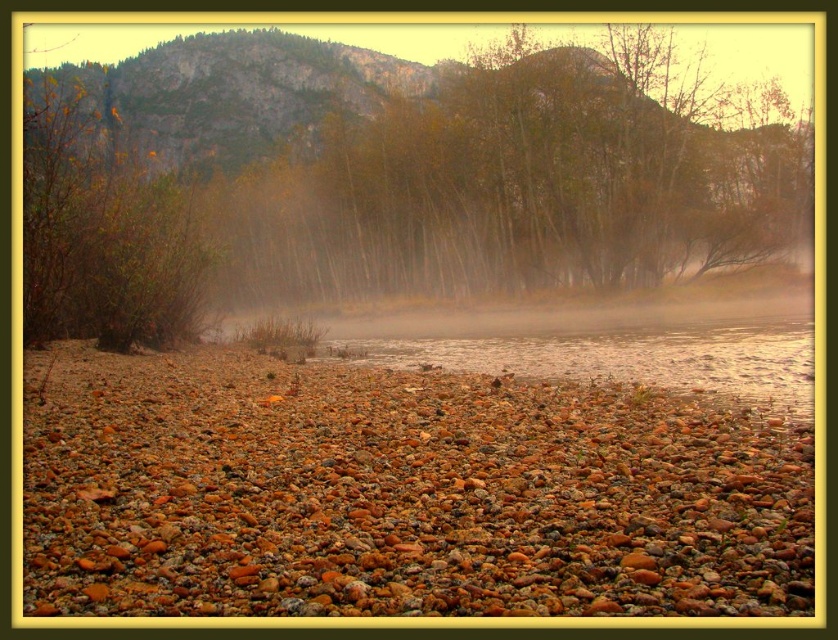
Based on the photo, between multicolored pebbles at center and brown textured trees at center, which one has more height?

Standing taller between the two is brown textured trees at center.

Looking at this image, can you confirm if multicolored pebbles at center is positioned to the left of brown textured trees at center?

Yes, multicolored pebbles at center is to the left of brown textured trees at center.

Is point (213, 452) positioned in front of point (652, 180)?

Yes, point (213, 452) is closer to viewer.

Find the location of a particular element. This screenshot has height=640, width=838. multicolored pebbles at center is located at coordinates (401, 492).